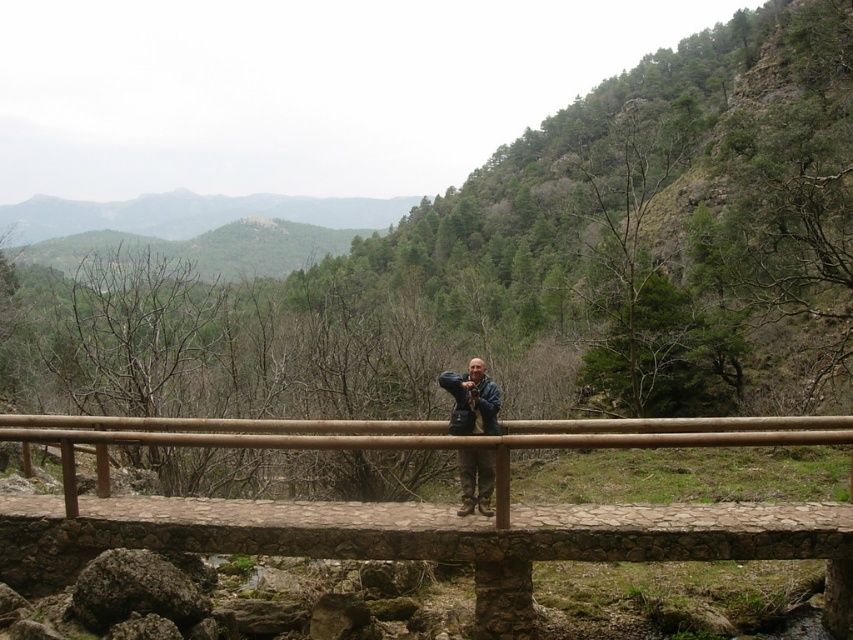
Question: Which point appears farthest from the camera in this image?

Choices:
 (A) (149, 420)
 (B) (467, 509)

Answer: (A)

Question: Which point is farther from the camera taking this photo?

Choices:
 (A) (329, 556)
 (B) (460, 484)

Answer: (B)

Question: Is brown wooden bridge at center closer to the viewer compared to blue denim jacket at center?

Choices:
 (A) no
 (B) yes

Answer: (A)

Question: Is brown wooden bridge at center to the left of blue denim jacket at center from the viewer's perspective?

Choices:
 (A) yes
 (B) no

Answer: (B)

Question: Which of the following is the farthest from the observer?

Choices:
 (A) blue denim jacket at center
 (B) brown wooden bridge at center

Answer: (B)

Question: Where is brown wooden bridge at center located in relation to blue denim jacket at center in the image?

Choices:
 (A) above
 (B) below

Answer: (A)